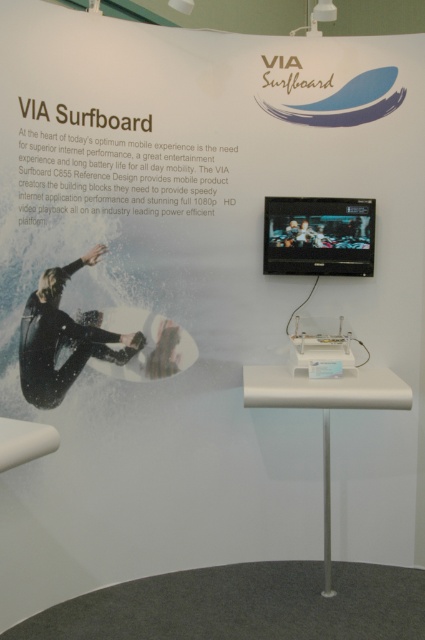
You are a customer at the promotional display for VIA Surfboard. You notice two points marked on the white panel. Which point is closer to you, point (67, 316) or point (93, 310)?

Point (67, 316) is in front of point (93, 310), so it is closer to you.